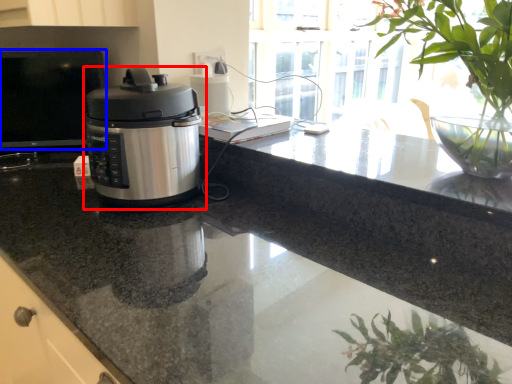
Question: Among these objects, which one is nearest to the camera, home appliance (highlighted by a red box) or desktop (highlighted by a blue box)?

Choices:
 (A) home appliance
 (B) desktop

Answer: (A)